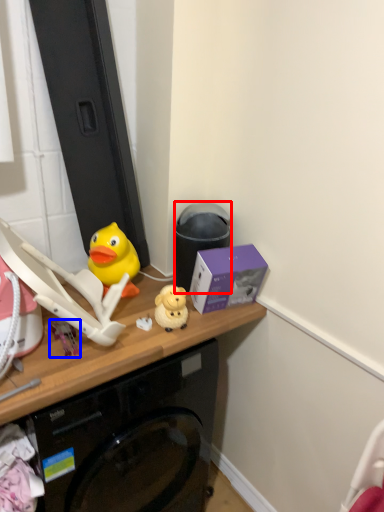
Question: Which object appears closest to the camera in this image, trash bin/can (highlighted by a red box) or toy (highlighted by a blue box)?

Choices:
 (A) trash bin/can
 (B) toy

Answer: (B)